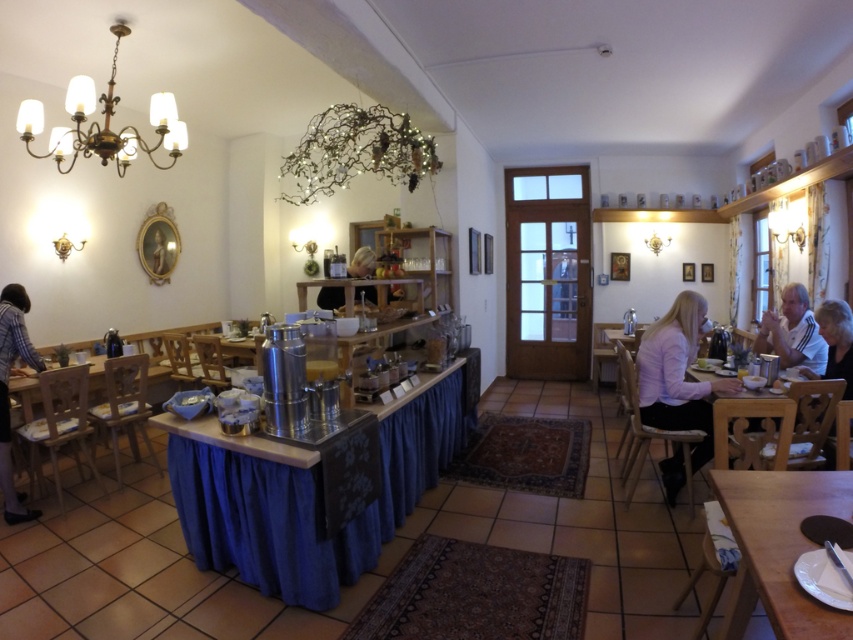
Looking at this image, between white matte shirt at right and white textured shirt at right, which one has more height?

white matte shirt at right

Which is above, white matte shirt at right or white textured shirt at right?

white matte shirt at right

Does point (764, 342) lie in front of point (822, 316)?

That is False.

Where is `white matte shirt at right`? white matte shirt at right is located at coordinates (792, 332).

Can you confirm if white matte shirt at center is wider than wooden table at right?

No, white matte shirt at center is not wider than wooden table at right.

Is white matte shirt at center positioned at the back of wooden table at right?

Yes, white matte shirt at center is further from the viewer.

Between point (706, 452) and point (793, 467), which one is positioned behind?

The point (706, 452) is behind.

The height and width of the screenshot is (640, 853). Find the location of `white matte shirt at center`. white matte shirt at center is located at coordinates (677, 374).

Between plaid shirt at left and blonde hair at center, which one is positioned higher?

blonde hair at center is higher up.

Consider the image. Is plaid shirt at left bigger than blonde hair at center?

Incorrect, plaid shirt at left is not larger than blonde hair at center.

Who is more forward, (4, 492) or (399, 298)?

Point (4, 492)

Identify the location of plaid shirt at left. This screenshot has width=853, height=640. (7, 390).